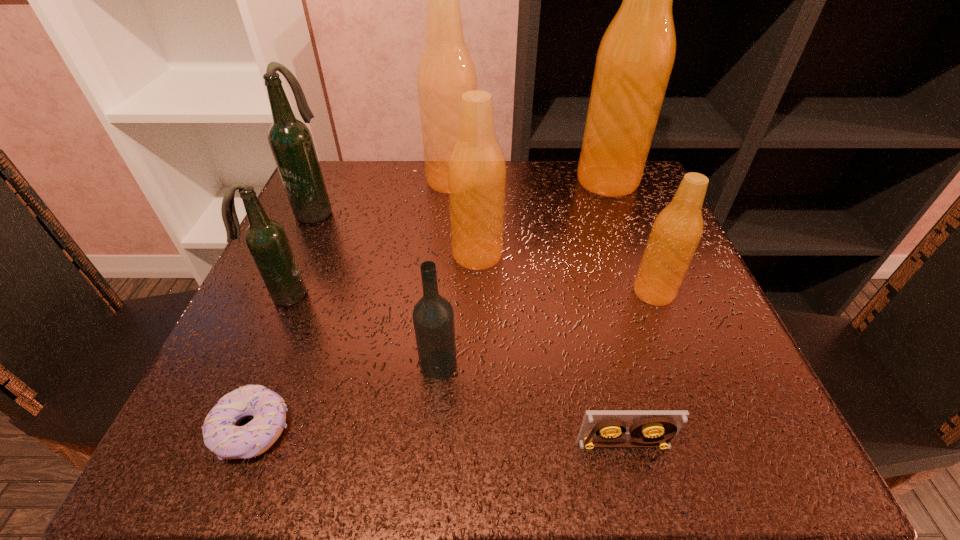
The image size is (960, 540). Find the location of `object at the near right corner`. object at the near right corner is located at coordinates (653, 428).

The height and width of the screenshot is (540, 960). I want to click on free space at the far edge, so click(427, 221).

Locate an element on the screen. This screenshot has height=540, width=960. vacant space at the near edge is located at coordinates (539, 421).

In order to click on vacant space at the left edge in this screenshot , I will do point(349,255).

Where is `vacant space at the right edge`? This screenshot has height=540, width=960. vacant space at the right edge is located at coordinates (607, 267).

The image size is (960, 540). Identify the location of vacant space at the far left corner of the desktop. (324, 170).

Find the location of a particular element. This screenshot has width=960, height=540. free spot at the near right corner of the desktop is located at coordinates (774, 453).

Image resolution: width=960 pixels, height=540 pixels. Identify the location of vacant region between the seventh farthest object and the eighth shortest object. (445, 273).

Find the location of a particular element. This screenshot has width=960, height=540. vacant space in between the bigger dark beer bottle and the vodka is located at coordinates (377, 288).

Locate an element on the screen. free space between the nearer dark beer bottle and the doughnut is located at coordinates (269, 362).